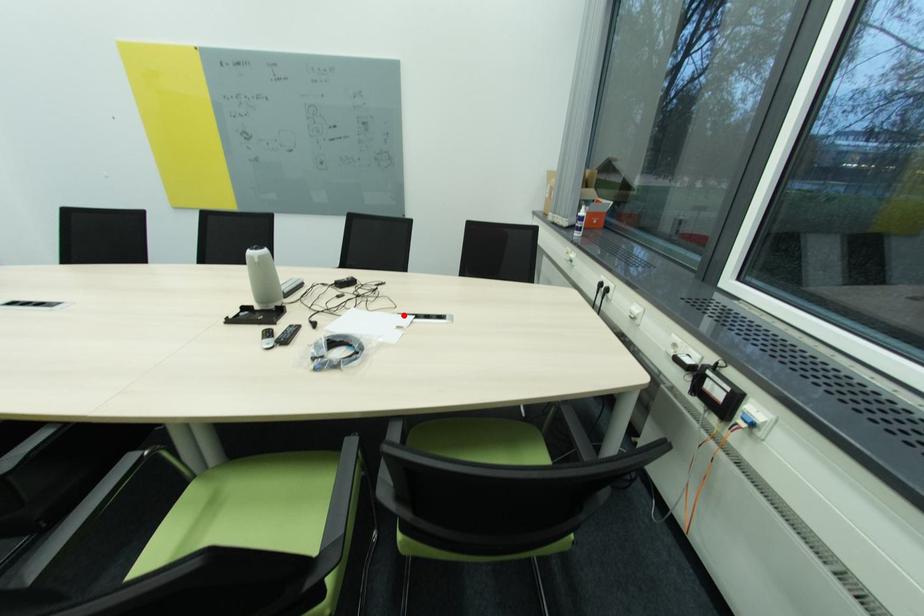
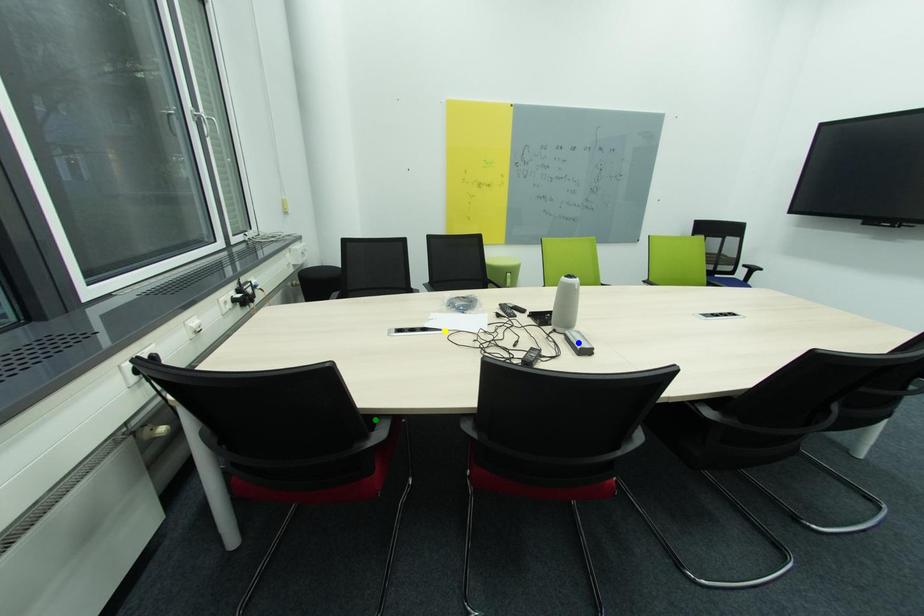
Question: I am providing you with two images of the same scene from different viewpoints. A red point is marked on the first image. You are given multiple points on the second image. Which point in image 2 represents the same 3d spot as the red point in image 1?

Choices:
 (A) green point
 (B) blue point
 (C) yellow point

Answer: (C)